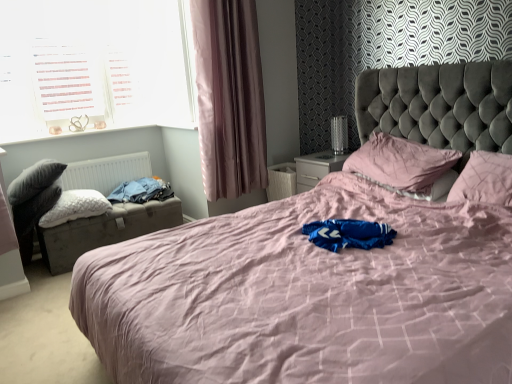
Where is `vacant space situated above white matte radiator at left (from a real-world perspective)`? vacant space situated above white matte radiator at left (from a real-world perspective) is located at coordinates (100, 156).